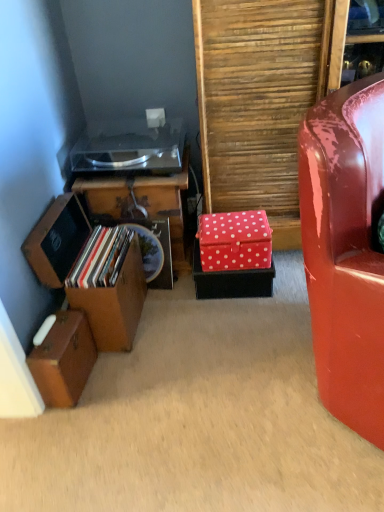
What are the coordinates of `vacant area to the right of wooden suitcase at lower left, placed as the third storage box when sorted from right to left` in the screenshot? It's located at (121, 379).